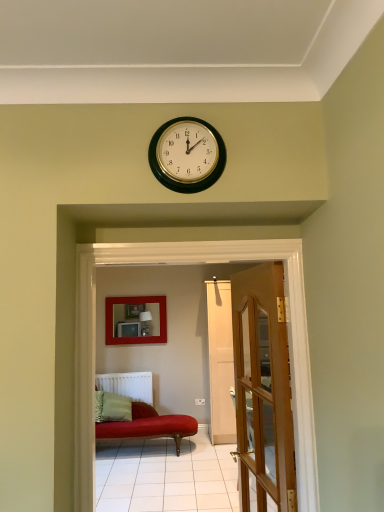
Question: Considering their positions, is matte red couch at center located in front of or behind wooden glass door at center?

Choices:
 (A) behind
 (B) front

Answer: (B)

Question: From the image's perspective, relative to wooden glass door at center, is matte red couch at center above or below?

Choices:
 (A) below
 (B) above

Answer: (B)

Question: Which is farther from the matte red couch at center?

Choices:
 (A) matte red picture frame at center
 (B) wooden glass door at center
 (C) green fabric pillow at lower left
 (D) white matte radiator at lower left

Answer: (A)

Question: Estimate the real-world distances between objects in this image. Which object is farther from the matte red couch at center?

Choices:
 (A) wooden glass door at center
 (B) green fabric pillow at lower left
 (C) white matte radiator at lower left
 (D) matte red picture frame at center

Answer: (D)